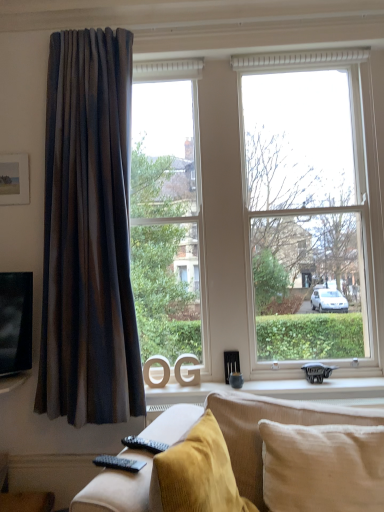
Question: Is velvet mustard studio couch at lower center further to camera compared to matte wooden picture frame at upper left?

Choices:
 (A) yes
 (B) no

Answer: (B)

Question: Does velvet mustard studio couch at lower center have a lesser width compared to matte wooden picture frame at upper left?

Choices:
 (A) no
 (B) yes

Answer: (A)

Question: From the image's perspective, is velvet mustard studio couch at lower center above matte wooden picture frame at upper left?

Choices:
 (A) yes
 (B) no

Answer: (B)

Question: Considering the relative sizes of velvet mustard studio couch at lower center and matte wooden picture frame at upper left in the image provided, is velvet mustard studio couch at lower center bigger than matte wooden picture frame at upper left?

Choices:
 (A) no
 (B) yes

Answer: (B)

Question: Is velvet mustard studio couch at lower center far away from matte wooden picture frame at upper left?

Choices:
 (A) no
 (B) yes

Answer: (B)

Question: Is velvet mustard studio couch at lower center positioned beyond the bounds of matte wooden picture frame at upper left?

Choices:
 (A) yes
 (B) no

Answer: (A)

Question: Does velvet mustard studio couch at lower center have a larger size compared to black plastic remote at lower left?

Choices:
 (A) yes
 (B) no

Answer: (A)

Question: Considering the relative sizes of velvet mustard studio couch at lower center and black plastic remote at lower left in the image provided, is velvet mustard studio couch at lower center shorter than black plastic remote at lower left?

Choices:
 (A) no
 (B) yes

Answer: (A)

Question: Considering the relative positions of velvet mustard studio couch at lower center and black plastic remote at lower left in the image provided, is velvet mustard studio couch at lower center to the left of black plastic remote at lower left from the viewer's perspective?

Choices:
 (A) no
 (B) yes

Answer: (A)

Question: Is velvet mustard studio couch at lower center facing towards black plastic remote at lower left?

Choices:
 (A) no
 (B) yes

Answer: (B)

Question: Can you confirm if velvet mustard studio couch at lower center is wider than black plastic remote at lower left?

Choices:
 (A) no
 (B) yes

Answer: (B)

Question: Is velvet mustard studio couch at lower center closer to the viewer compared to black plastic remote at lower left?

Choices:
 (A) no
 (B) yes

Answer: (B)

Question: Would you say matte brown curtain at left is part of beige cotton pillow at lower right's contents?

Choices:
 (A) no
 (B) yes

Answer: (A)